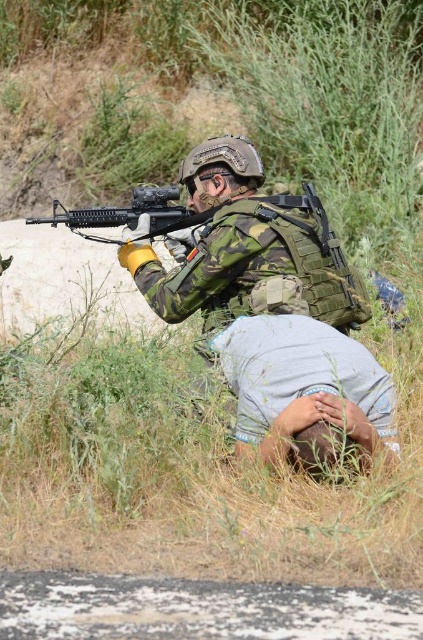
Question: Does camo fabric uniform at center appear over matte black rifle at center?

Choices:
 (A) yes
 (B) no

Answer: (B)

Question: Which object is the farthest from the camo fabric uniform at center?

Choices:
 (A) matte black rifle at center
 (B) gray cotton squat at lower center

Answer: (B)

Question: Is camo fabric uniform at center thinner than gray cotton squat at lower center?

Choices:
 (A) no
 (B) yes

Answer: (A)

Question: Is gray cotton squat at lower center to the left of matte black rifle at center from the viewer's perspective?

Choices:
 (A) no
 (B) yes

Answer: (A)

Question: Which object is positioned closest to the gray cotton squat at lower center?

Choices:
 (A) matte black rifle at center
 (B) camo fabric uniform at center

Answer: (B)

Question: Which point is farther from the camera taking this photo?

Choices:
 (A) (351, 422)
 (B) (200, 234)

Answer: (B)